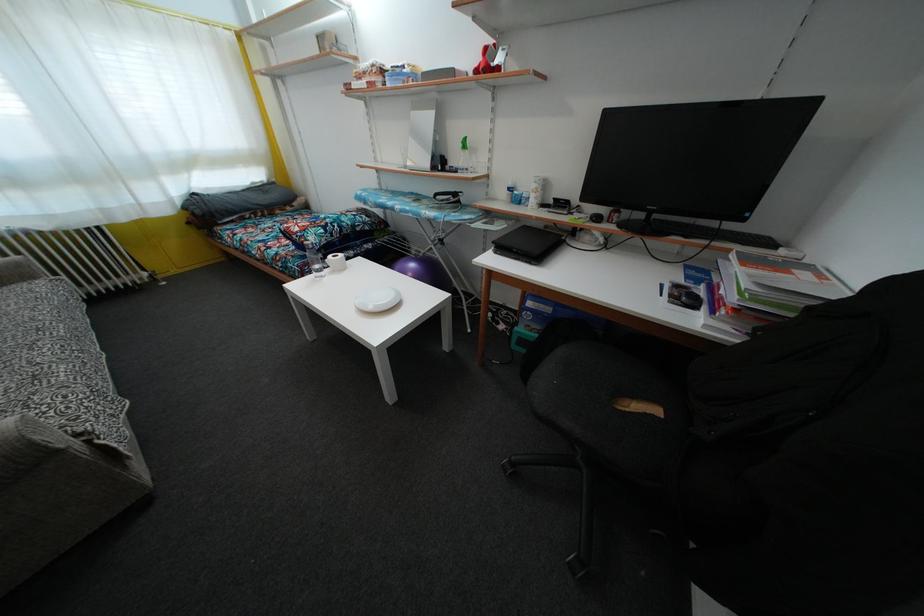
The width and height of the screenshot is (924, 616). I want to click on clear water bottle, so click(x=313, y=259).